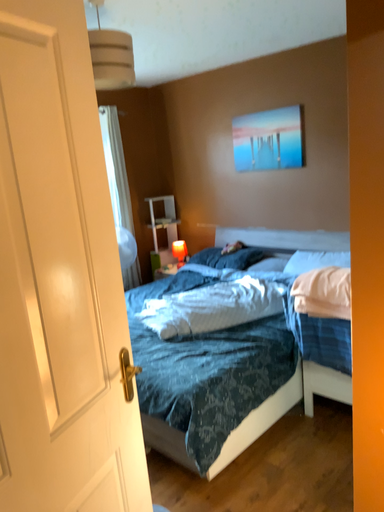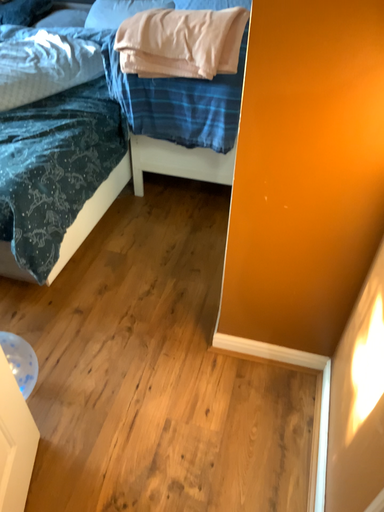
Question: Which way did the camera rotate in the video?

Choices:
 (A) rotated right
 (B) rotated left

Answer: (A)